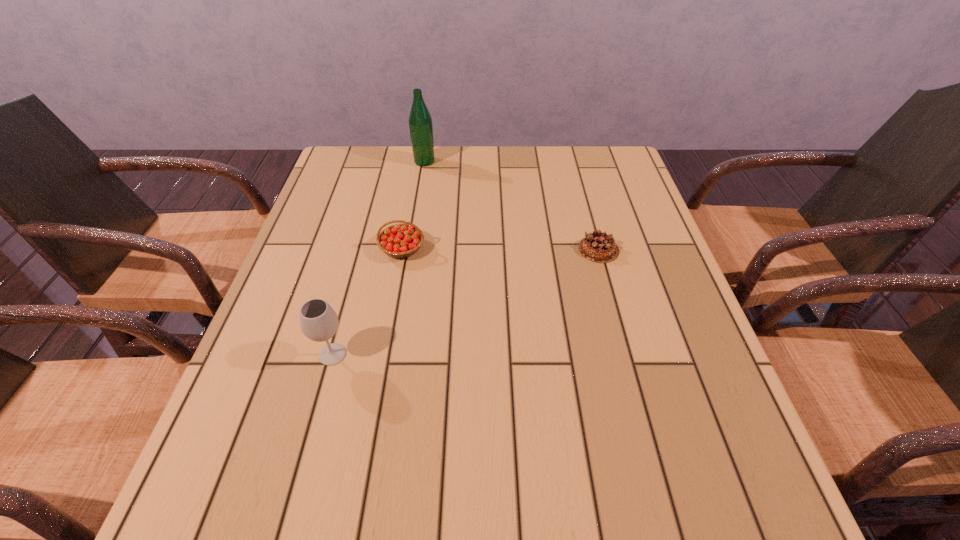
Identify the location of object that stands as the third closest to the strawberry. (598, 247).

I want to click on vacant position in the image that satisfies the following two spatial constraints: 1. on the back side of the leftmost object; 2. on the right side of the shortest object, so click(x=362, y=249).

Locate an element on the screen. free location that satisfies the following two spatial constraints: 1. on the front side of the strawberry; 2. on the right side of the rightmost object is located at coordinates (402, 249).